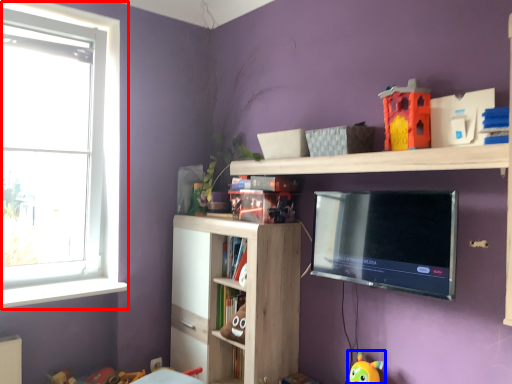
Question: Which object appears farthest to the camera in this image, window (highlighted by a red box) or toy (highlighted by a blue box)?

Choices:
 (A) window
 (B) toy

Answer: (A)